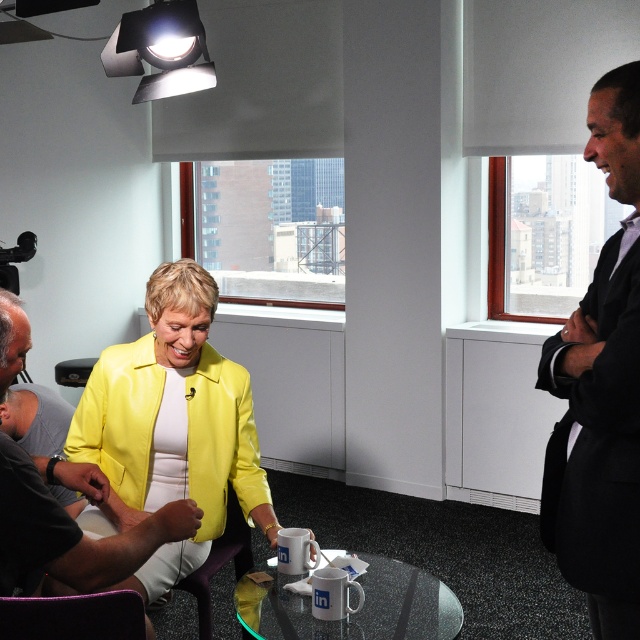
Question: Which object appears farthest from the camera in this image?

Choices:
 (A) matte black shirt at lower left
 (B) clear glass table at center
 (C) black suit at right
 (D) yellow leather jacket at center

Answer: (D)

Question: Considering the real-world distances, which object is closest to the yellow leather jacket at center?

Choices:
 (A) black suit at right
 (B) matte black shirt at lower left
 (C) clear glass table at center

Answer: (B)

Question: Can you confirm if yellow leather jacket at center is bigger than matte black shirt at lower left?

Choices:
 (A) no
 (B) yes

Answer: (B)

Question: Which point is farther from the camera taking this photo?

Choices:
 (A) (12, 564)
 (B) (141, 348)

Answer: (B)

Question: Is black suit at right thinner than matte black shirt at lower left?

Choices:
 (A) no
 (B) yes

Answer: (B)

Question: Is black suit at right positioned behind matte black shirt at lower left?

Choices:
 (A) yes
 (B) no

Answer: (A)